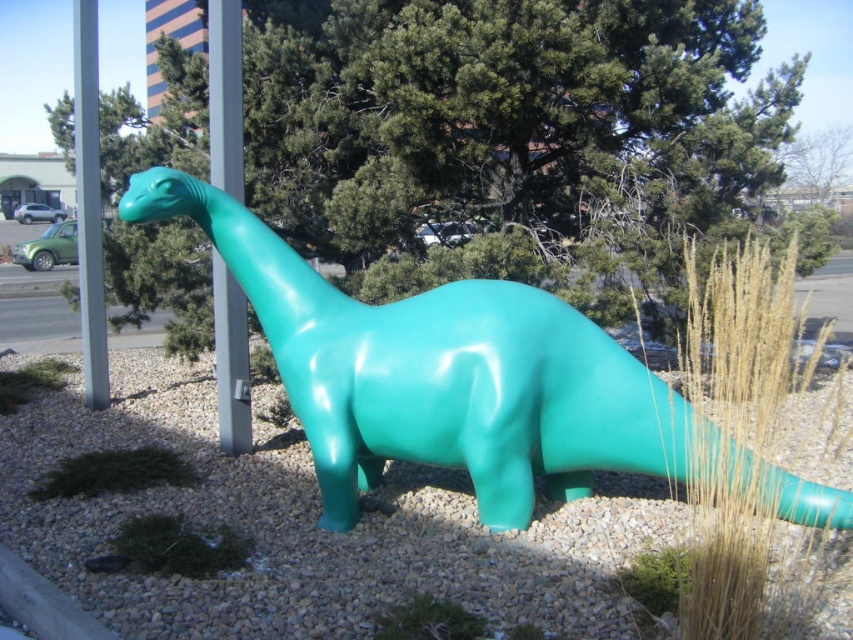
Question: Does green glossy dinosaur at center have a greater width compared to metallic gray pole at upper left?

Choices:
 (A) yes
 (B) no

Answer: (A)

Question: Does glossy plastic dinosaur at center have a greater width compared to metallic gray pole at upper center?

Choices:
 (A) no
 (B) yes

Answer: (B)

Question: Estimate the real-world distances between objects in this image. Which object is farther from the green glossy dinosaur at center?

Choices:
 (A) glossy plastic dinosaur at center
 (B) metallic gray pole at upper left

Answer: (B)

Question: Among these points, which one is nearest to the camera?

Choices:
 (A) (223, 90)
 (B) (105, 362)
 (C) (22, 472)
 (D) (585, 323)

Answer: (D)

Question: Can you confirm if green glossy dinosaur at center is positioned to the right of glossy plastic dinosaur at center?

Choices:
 (A) no
 (B) yes

Answer: (A)

Question: Considering the real-world distances, which object is farthest from the glossy plastic dinosaur at center?

Choices:
 (A) metallic gray pole at upper left
 (B) metallic gray pole at upper center

Answer: (A)